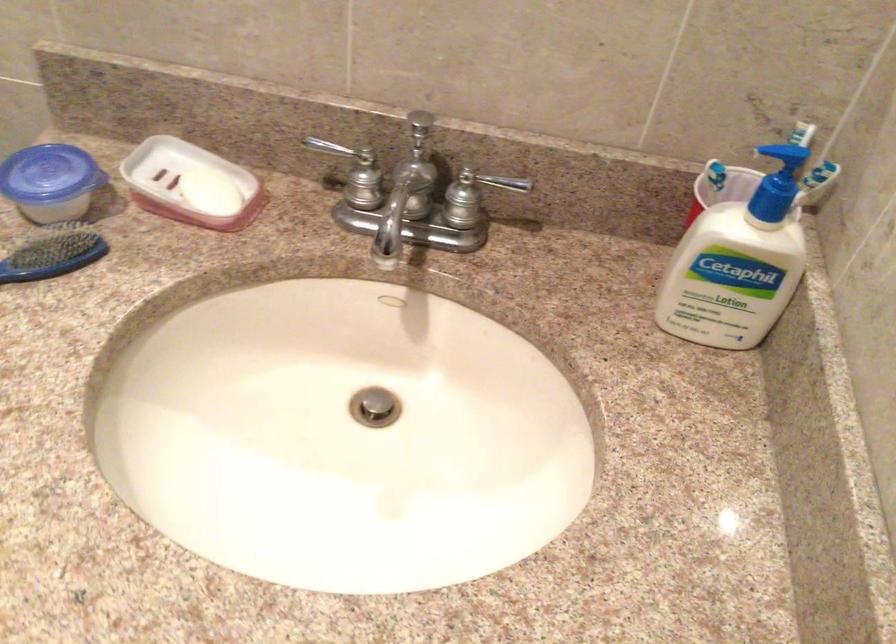
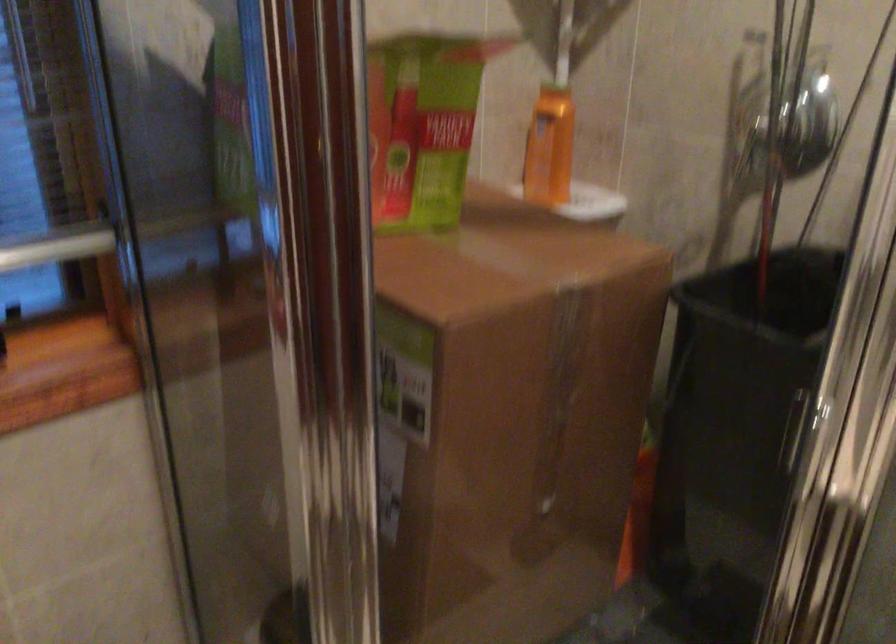
The first image is from the beginning of the video and the second image is from the end. How did the camera likely rotate when shooting the video?

The camera's rotation is toward left-up.